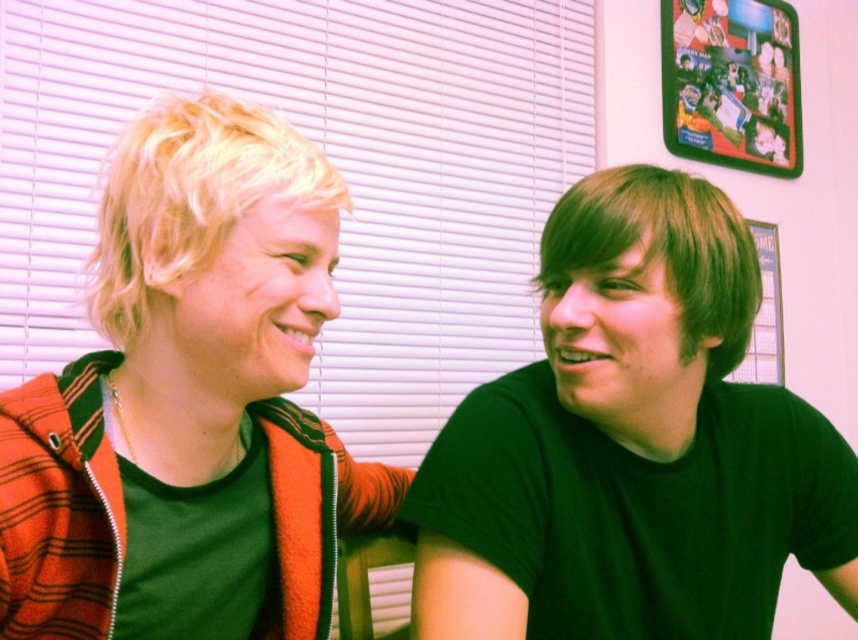
You are a fashion designer observing two people in the image. You need to decide which clothing item is positioned higher on the body between the matte orange hoodie at left and the green matte shirt at right. Which one is higher?

The matte orange hoodie at left is positioned higher on the body than the green matte shirt at right.

You are a delivery robot with a package that measures 12 inches in length. You need to place the package between the matte orange hoodie at left and the green matte shirt at right. Is there enough space between them to fit the package?

The distance between the matte orange hoodie at left and the green matte shirt at right is 10.04 inches, which is less than the 12 inches required for the package. Therefore, there isn not enough space to fit the package between them.

You are an interior designer assessing the spatial arrangement of clothing items in a photo. The matte orange hoodie at left and the green matte shirt at right are displayed on a rack. If you want to ensure both items are visible to customers, which item should you adjust to be lower so the other isn t blocked?

The matte orange hoodie at left is taller than the green matte shirt at right, so you should lower the matte orange hoodie at left to prevent it from blocking the view of the green matte shirt at right.